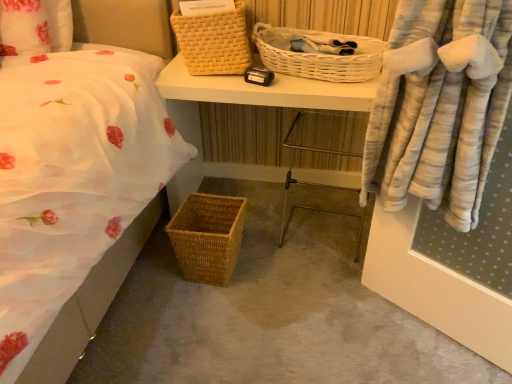
Identify the location of free spot to the left of woven brown picnic basket at lower left, the first picnic basket positioned from the bottom. (151, 272).